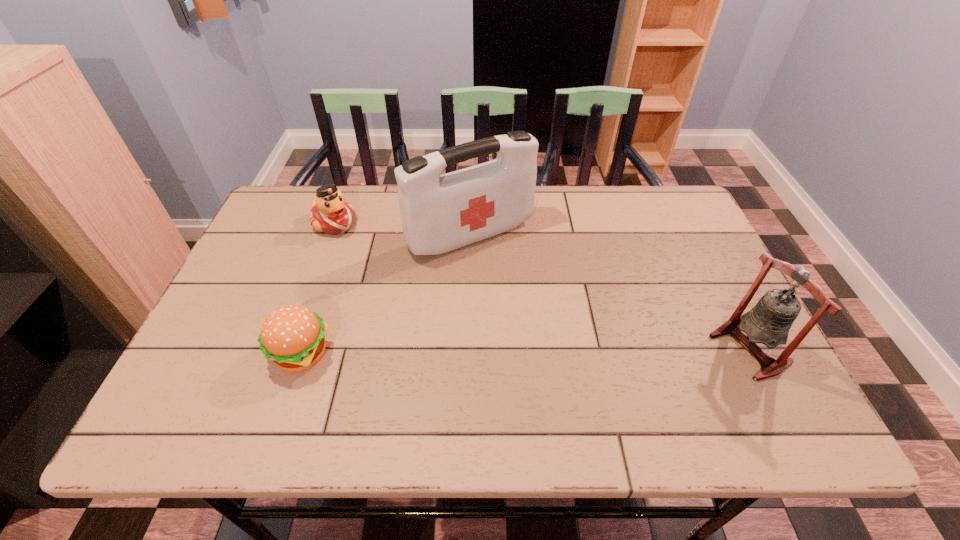
This screenshot has width=960, height=540. Identify the location of hamburger. (292, 336).

Where is `bell`? bell is located at coordinates (769, 321).

Where is `the first-aid kit`? the first-aid kit is located at coordinates (439, 213).

This screenshot has height=540, width=960. Identify the location of duck. (330, 213).

This screenshot has width=960, height=540. What are the coordinates of `vacant space located 0.260m on the right of the hamburger` in the screenshot? It's located at (449, 354).

Where is `vacant space situated 0.190m on the left of the rightmost object`? The width and height of the screenshot is (960, 540). vacant space situated 0.190m on the left of the rightmost object is located at coordinates (630, 349).

You are a GUI agent. You are given a task and a screenshot of the screen. Output one action in this format:
    pyautogui.click(x=<x>, y=<y>)
    Task: Click on the blank space located on the front side of the second object from right to left
    Image resolution: width=960 pixels, height=540 pixels.
    Given the screenshot: What is the action you would take?
    pyautogui.click(x=515, y=276)

Find the location of `vacant space situated 0.100m on the front side of the second object from right to left`. vacant space situated 0.100m on the front side of the second object from right to left is located at coordinates (521, 284).

I want to click on free spot located on the front side of the second object from right to left, so click(x=572, y=347).

Find the location of a particular element. The image size is (960, 540). vacant point located on the face of the duck is located at coordinates (390, 268).